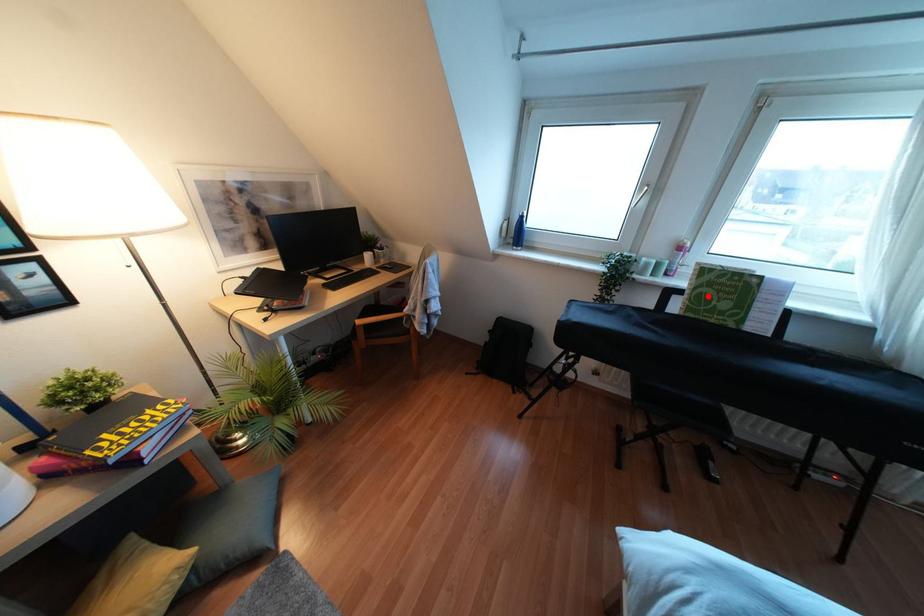
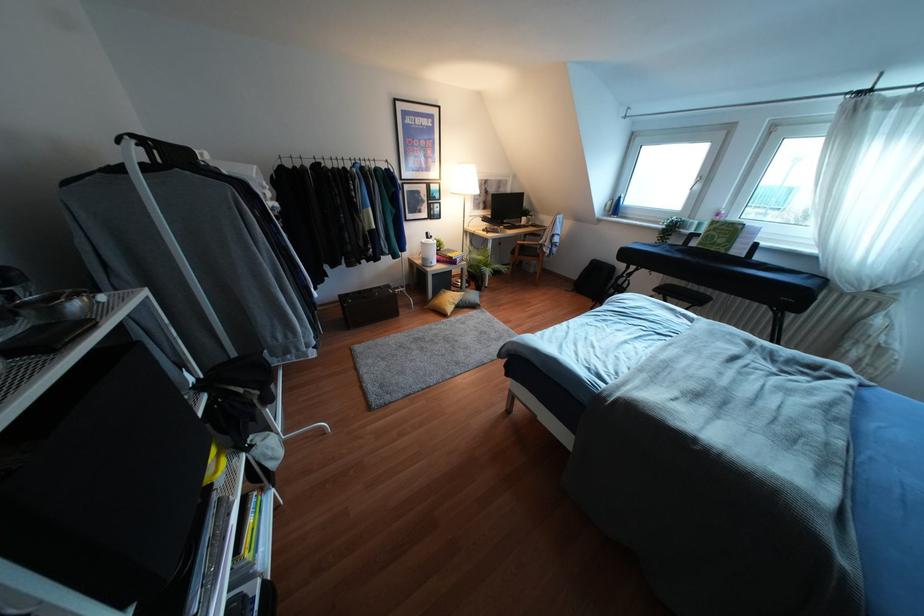
In the second image, find the point that corresponds to the highlighted location in the first image.

(712, 236)